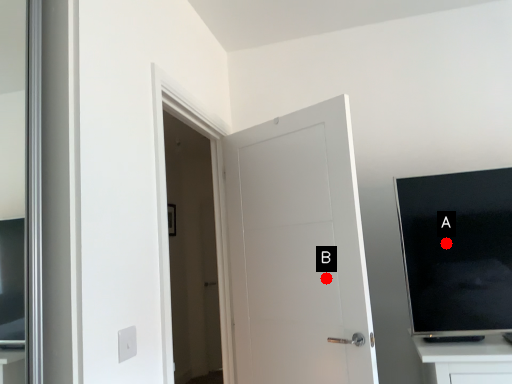
Question: Two points are circled on the image, labeled by A and B beside each circle. Which point is further to the camera?

Choices:
 (A) A is further
 (B) B is further

Answer: (B)